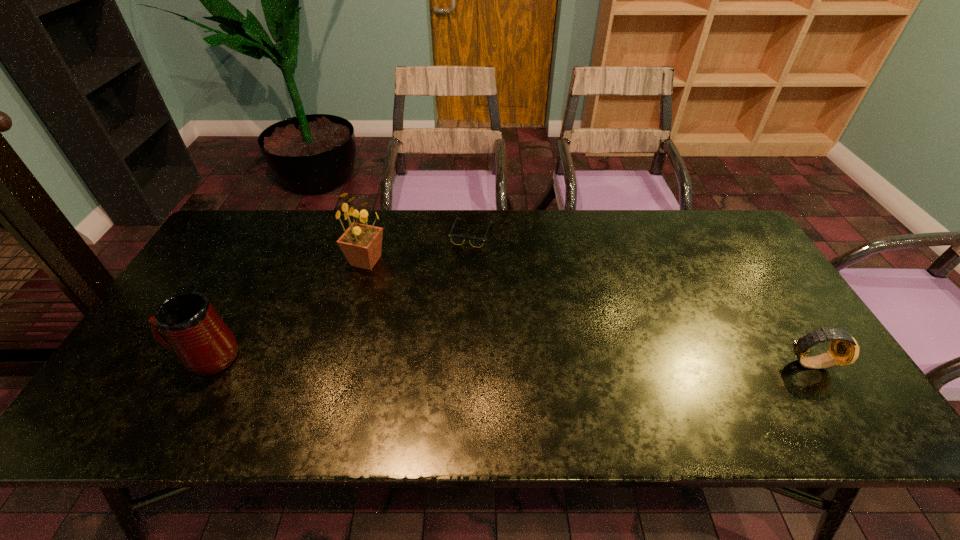
The image size is (960, 540). I want to click on free space on the desktop that is between the leftmost object and the second shortest object and is positioned on the lenses of the shortest object, so click(522, 360).

The image size is (960, 540). I want to click on free space on the desktop that is between the leftmost object and the third tallest object and is positioned at the front of the sunflower with flowers visible, so tap(418, 359).